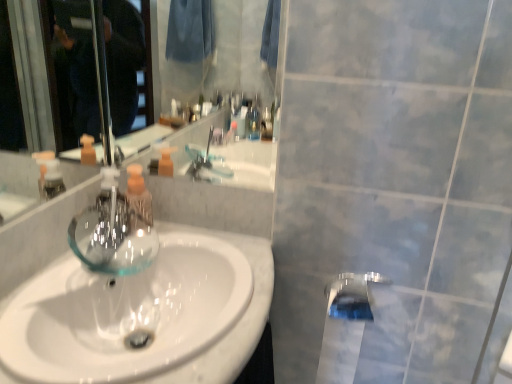
Question: Is clear glass faucet at center to the right of chrome metallic tap at lower center from the viewer's perspective?

Choices:
 (A) no
 (B) yes

Answer: (A)

Question: Considering the relative sizes of clear glass faucet at center and chrome metallic tap at lower center in the image provided, is clear glass faucet at center wider than chrome metallic tap at lower center?

Choices:
 (A) yes
 (B) no

Answer: (A)

Question: Is chrome metallic tap at lower center completely or partially inside clear glass faucet at center?

Choices:
 (A) no
 (B) yes

Answer: (A)

Question: Is clear glass faucet at center thinner than chrome metallic tap at lower center?

Choices:
 (A) no
 (B) yes

Answer: (A)

Question: Considering the relative positions of clear glass faucet at center and chrome metallic tap at lower center in the image provided, is clear glass faucet at center to the left of chrome metallic tap at lower center from the viewer's perspective?

Choices:
 (A) no
 (B) yes

Answer: (B)

Question: From the image's perspective, is clear glass faucet at center located above chrome metallic tap at lower center?

Choices:
 (A) no
 (B) yes

Answer: (B)

Question: Are clear glass bottle at center and chrome metallic tap at lower center far apart?

Choices:
 (A) yes
 (B) no

Answer: (B)

Question: From a real-world perspective, is clear glass bottle at center below chrome metallic tap at lower center?

Choices:
 (A) no
 (B) yes

Answer: (A)

Question: Can you confirm if clear glass bottle at center is shorter than chrome metallic tap at lower center?

Choices:
 (A) yes
 (B) no

Answer: (B)

Question: Is clear glass bottle at center bigger than chrome metallic tap at lower center?

Choices:
 (A) no
 (B) yes

Answer: (A)

Question: Is clear glass bottle at center positioned beyond the bounds of chrome metallic tap at lower center?

Choices:
 (A) yes
 (B) no

Answer: (A)

Question: Is clear glass bottle at center further to the viewer compared to chrome metallic tap at lower center?

Choices:
 (A) no
 (B) yes

Answer: (B)

Question: Does chrome metallic tap at lower center have a lesser height compared to clear glass bottle at center?

Choices:
 (A) no
 (B) yes

Answer: (B)